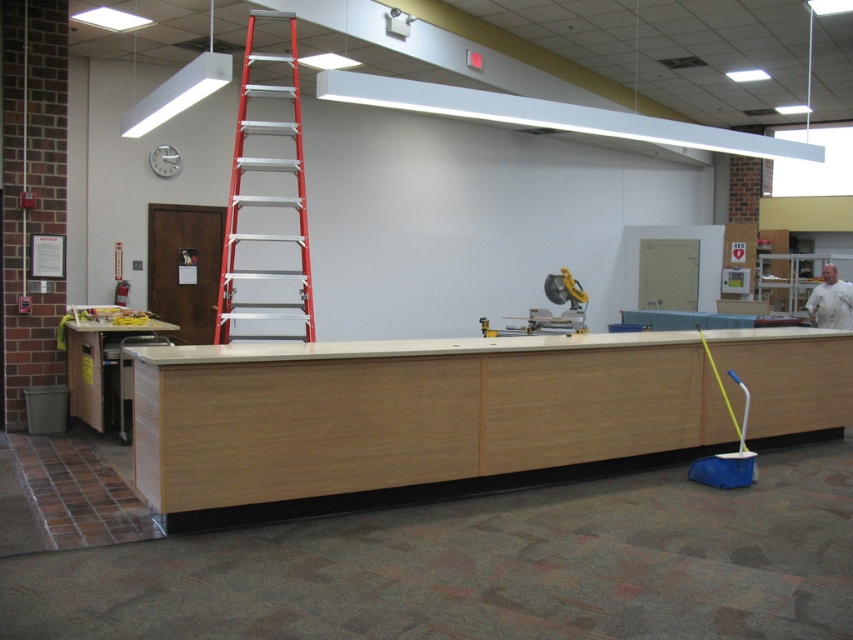
Which of these two, light wood counter at center or wooden cabinet at lower left, stands shorter?

With less height is light wood counter at center.

Can you confirm if light wood counter at center is positioned to the right of wooden cabinet at lower left?

Yes, light wood counter at center is to the right of wooden cabinet at lower left.

I want to click on light wood counter at center, so click(x=407, y=420).

Who is positioned more to the right, red aluminum ladder at upper center or wooden cabinet at lower left?

red aluminum ladder at upper center is more to the right.

Who is more forward, [279,58] or [73,416]?

Point [279,58]

The image size is (853, 640). In order to click on red aluminum ladder at upper center in this screenshot , I will do `click(265, 198)`.

How distant is light wood counter at center from red aluminum ladder at upper center?

light wood counter at center and red aluminum ladder at upper center are 2.07 meters apart from each other.

Is point (820, 435) closer to camera compared to point (305, 228)?

No.

Does point (418, 484) come closer to viewer compared to point (299, 182)?

Yes, point (418, 484) is closer to viewer.

This screenshot has width=853, height=640. Identify the location of light wood counter at center. (407, 420).